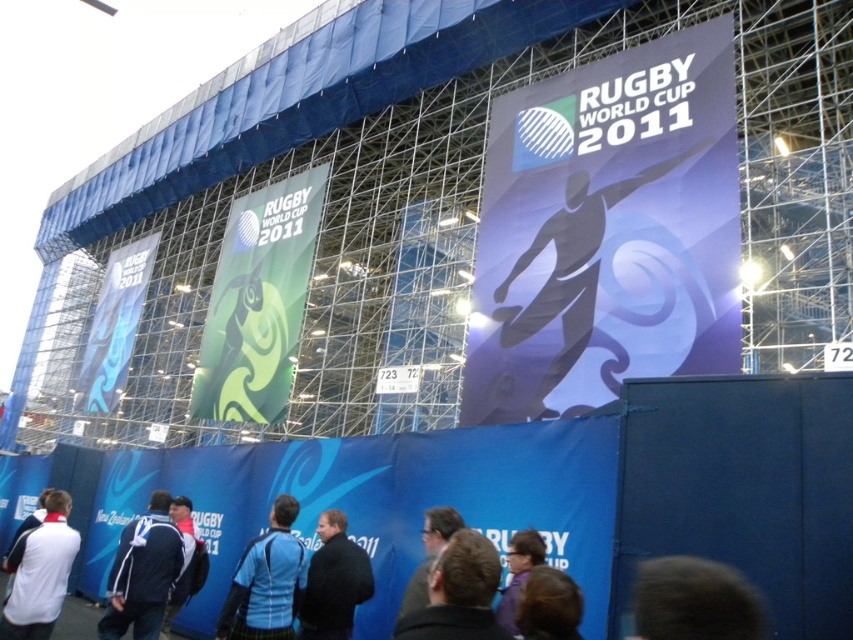
Question: Does dark brown hair at lower center appear under purple fabric at center?

Choices:
 (A) yes
 (B) no

Answer: (B)

Question: Among these objects, which one is farthest from the camera?

Choices:
 (A) dark blue sweater at center
 (B) purple fabric at center

Answer: (A)

Question: Which point appears closest to the camera in this image?

Choices:
 (A) (x=567, y=579)
 (B) (x=172, y=513)
 (C) (x=239, y=570)
 (D) (x=1, y=612)

Answer: (A)

Question: Where is dark brown hair at lower center located in relation to purple fabric at center in the image?

Choices:
 (A) left
 (B) right

Answer: (B)

Question: Which point is farther to the camera?

Choices:
 (A) blue fabric jacket at lower left
 (B) blue fabric jacket at center
 (C) purple fabric at center
 (D) dark blue shirt at center

Answer: (A)

Question: Is blue fabric jacket at center bigger than dark blue shirt at center?

Choices:
 (A) no
 (B) yes

Answer: (A)